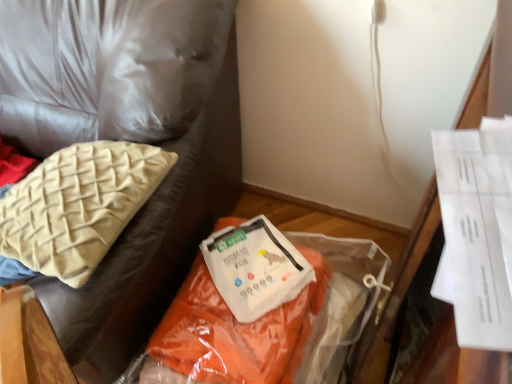
Question: From the image's perspective, is white paper at center positioned above or below orange fabric at center?

Choices:
 (A) below
 (B) above

Answer: (B)

Question: Looking at their shapes, would you say white paper at center is wider or thinner than orange fabric at center?

Choices:
 (A) thin
 (B) wide

Answer: (A)

Question: Which object is the closest to the orange fabric at center?

Choices:
 (A) beige woven cushion at upper left
 (B) orange fabric bag at lower right
 (C) white paper at center

Answer: (C)

Question: Based on their relative distances, which object is nearer to the white paper at center?

Choices:
 (A) orange fabric bag at lower right
 (B) beige woven cushion at upper left
 (C) orange fabric at center

Answer: (C)